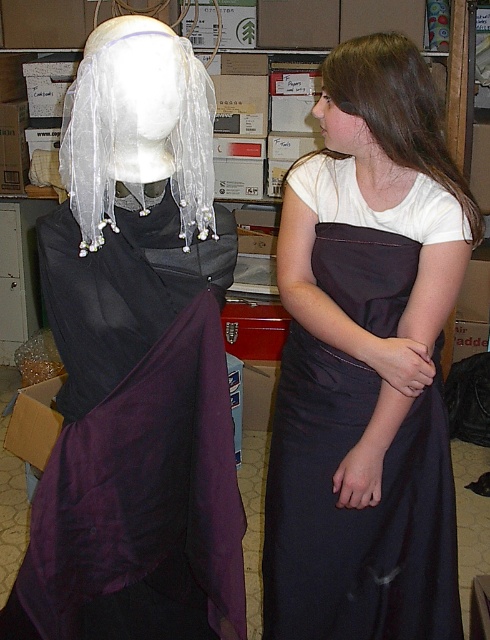
From the picture: Is purple satin shawl at left behind brown silky hair at upper right?

No.

Does purple satin shawl at left appear over brown silky hair at upper right?

Incorrect, purple satin shawl at left is not positioned above brown silky hair at upper right.

Who is more distant from viewer, (23, 596) or (400, 76)?

The point (400, 76) is behind.

Locate an element on the screen. purple satin shawl at left is located at coordinates (136, 442).

Is satin dress at center above purple satin shawl at left?

Yes, satin dress at center is above purple satin shawl at left.

Who is shorter, satin dress at center or purple satin shawl at left?

purple satin shawl at left

Locate an element on the screen. satin dress at center is located at coordinates (367, 362).

Does satin dress at center have a greater height compared to brown hair at upper right?

Correct, satin dress at center is much taller as brown hair at upper right.

Between satin dress at center and brown hair at upper right, which one appears on the right side from the viewer's perspective?

Positioned to the right is brown hair at upper right.

Locate an element on the screen. satin dress at center is located at coordinates (367, 362).